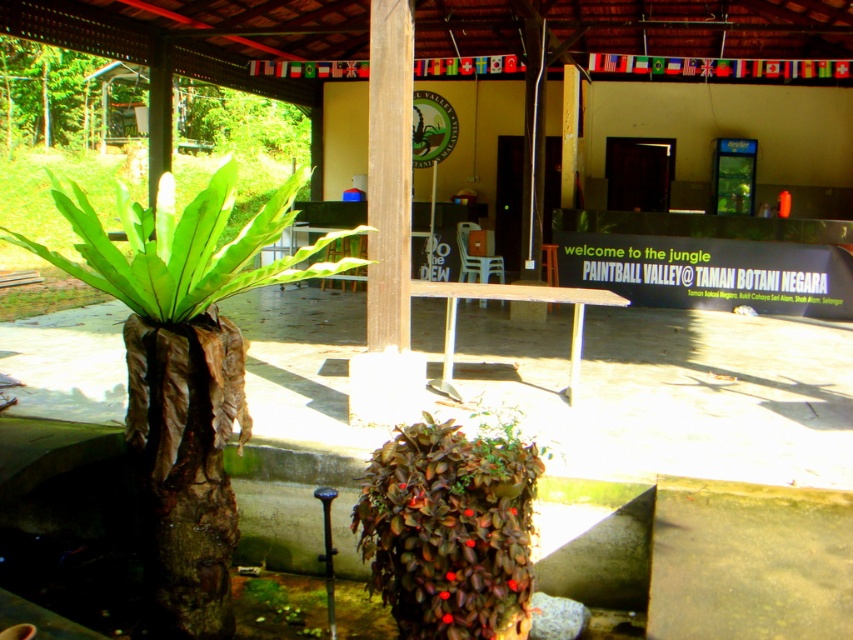
You are standing at the entrance of the covered structure in the image. You need to locate the green leafy plant at left. What are the coordinates where you should look to find it?

The green leafy plant at left is located at coordinates point (x=184, y=369).

You are a painter standing at the center of the covered structure. You want to paint both the green leafy plant at left and the other plant with smaller reddish brown leaves. How far apart are these two plants?

The green leafy plant at left and the other plant with smaller reddish brown leaves are 2.65 meters apart.

You are a visitor at the paintball venue and see the green leafy plant at left and the leathery brown plant at center. Which plant is closer to you?

The green leafy plant at left is closer to you because it is positioned over the leathery brown plant at center, indicating it is in front.